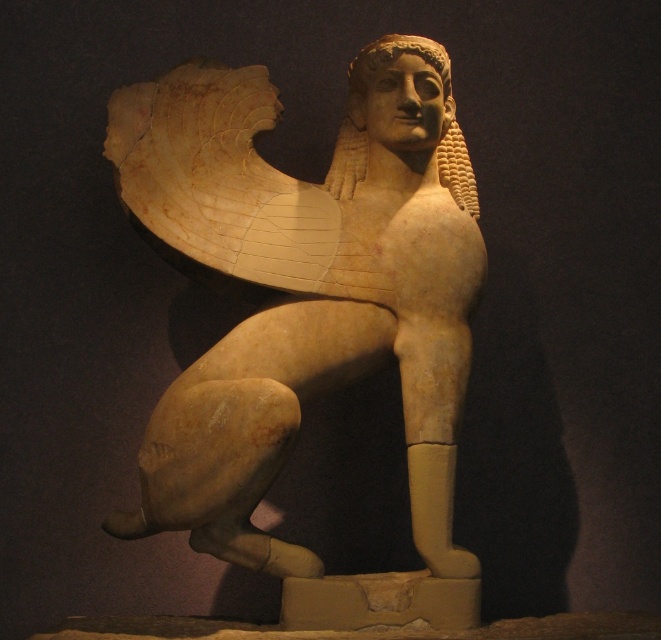
Question: Is beige stone sphinx at center smaller than golden stone head at center?

Choices:
 (A) yes
 (B) no

Answer: (B)

Question: Does beige stone sphinx at center have a lesser width compared to golden stone head at center?

Choices:
 (A) no
 (B) yes

Answer: (A)

Question: Which object is closer to the camera taking this photo?

Choices:
 (A) golden stone head at center
 (B) beige stone sphinx at center

Answer: (B)

Question: Does beige stone sphinx at center appear on the left side of golden stone head at center?

Choices:
 (A) yes
 (B) no

Answer: (A)